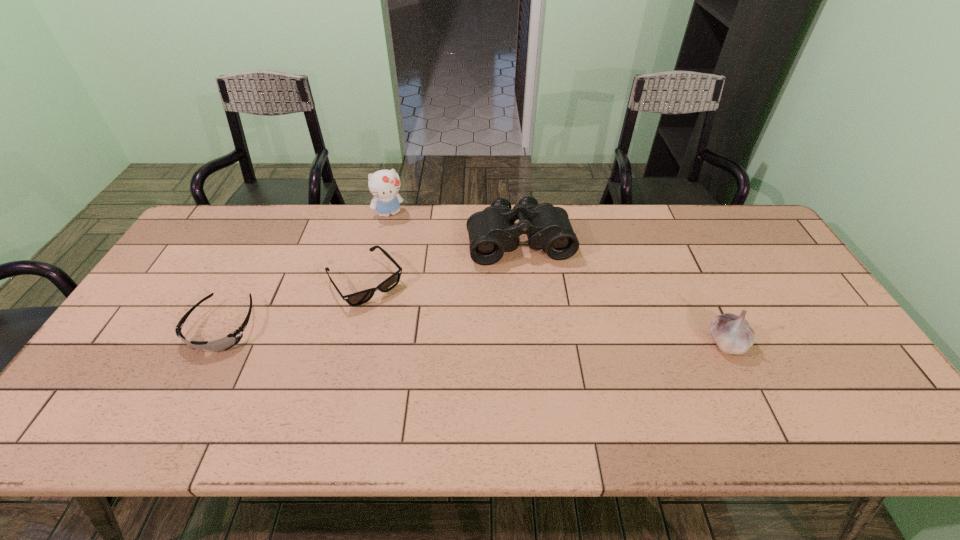
Locate an element on the screen. free space between the rightmost object and the kitten is located at coordinates (558, 278).

Image resolution: width=960 pixels, height=540 pixels. I want to click on blank region between the fourth tallest object and the leftmost object, so click(x=294, y=305).

At what (x,y) coordinates should I click in order to perform the action: click on free area in between the taller sunglasses and the shortest object. Please return your answer as a coordinate pair (x, y). The image size is (960, 540). Looking at the image, I should click on (294, 305).

Image resolution: width=960 pixels, height=540 pixels. I want to click on unoccupied area between the shortest object and the tallest object, so click(x=306, y=271).

Where is `free point between the fourth object from left to right and the fourth tallest object`? Image resolution: width=960 pixels, height=540 pixels. free point between the fourth object from left to right and the fourth tallest object is located at coordinates (443, 262).

Identify which object is located as the second nearest to the second shortest object. Please provide its 2D coordinates. Your answer should be formatted as a tuple, i.e. [(x, y)], where the tuple contains the x and y coordinates of a point satisfying the conditions above.

[(384, 184)]

The height and width of the screenshot is (540, 960). What are the coordinates of `object that is the fourth closest one to the shorter sunglasses` in the screenshot? It's located at (733, 335).

At what (x,y) coordinates should I click in order to perform the action: click on blank space that satisfies the following two spatial constraints: 1. on the front side of the garlic; 2. on the left side of the binoculars. Please return your answer as a coordinate pair (x, y). Looking at the image, I should click on (529, 342).

At what (x,y) coordinates should I click in order to perform the action: click on free spot that satisfies the following two spatial constraints: 1. on the back side of the binoculars; 2. on the right side of the right sunglasses. Please return your answer as a coordinate pair (x, y). This screenshot has height=540, width=960. Looking at the image, I should click on (376, 241).

Where is `vacant space that satisfies the following two spatial constraints: 1. on the front side of the right sunglasses; 2. on the right side of the rightmost object`? The image size is (960, 540). vacant space that satisfies the following two spatial constraints: 1. on the front side of the right sunglasses; 2. on the right side of the rightmost object is located at coordinates point(350,342).